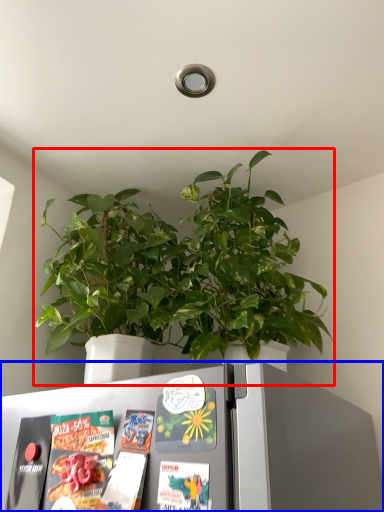
Question: Among these objects, which one is farthest to the camera, houseplant (highlighted by a red box) or refrigerator (highlighted by a blue box)?

Choices:
 (A) houseplant
 (B) refrigerator

Answer: (A)